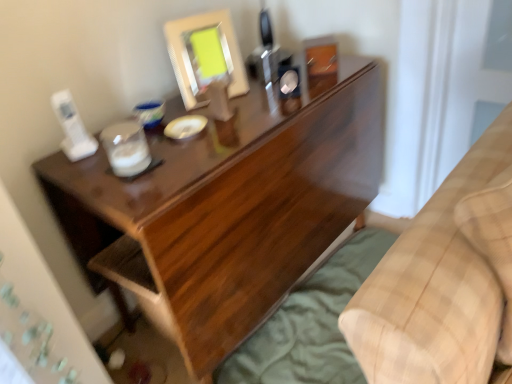
Question: Is dark wood desk at center looking in the opposite direction of beige plaid blanket at lower right?

Choices:
 (A) yes
 (B) no

Answer: (B)

Question: From a real-world perspective, is dark wood desk at center located beneath beige plaid blanket at lower right?

Choices:
 (A) yes
 (B) no

Answer: (A)

Question: Is dark wood desk at center located outside beige plaid blanket at lower right?

Choices:
 (A) no
 (B) yes

Answer: (B)

Question: From the image's perspective, is dark wood desk at center on beige plaid blanket at lower right?

Choices:
 (A) no
 (B) yes

Answer: (B)

Question: Is dark wood desk at center aimed at beige plaid blanket at lower right?

Choices:
 (A) yes
 (B) no

Answer: (A)

Question: Choose the correct answer: Is dark wood desk at center inside green fabric sheet at lower right or outside it?

Choices:
 (A) inside
 (B) outside

Answer: (B)

Question: In terms of size, does dark wood desk at center appear bigger or smaller than green fabric sheet at lower right?

Choices:
 (A) small
 (B) big

Answer: (B)

Question: From the image's perspective, is dark wood desk at center positioned above or below green fabric sheet at lower right?

Choices:
 (A) below
 (B) above

Answer: (B)

Question: Relative to green fabric sheet at lower right, is dark wood desk at center in front or behind?

Choices:
 (A) front
 (B) behind

Answer: (A)

Question: Is dark wood desk at center wider or thinner than beige plaid blanket at lower right?

Choices:
 (A) wide
 (B) thin

Answer: (A)

Question: In terms of size, does dark wood desk at center appear bigger or smaller than beige plaid blanket at lower right?

Choices:
 (A) small
 (B) big

Answer: (B)

Question: Considering their positions, is dark wood desk at center located in front of or behind beige plaid blanket at lower right?

Choices:
 (A) front
 (B) behind

Answer: (B)

Question: Is dark wood desk at center spatially inside beige plaid blanket at lower right, or outside of it?

Choices:
 (A) outside
 (B) inside

Answer: (A)

Question: From a real-world perspective, is beige plaid blanket at lower right above or below matte white frame at upper center?

Choices:
 (A) below
 (B) above

Answer: (A)

Question: Is beige plaid blanket at lower right inside or outside of matte white frame at upper center?

Choices:
 (A) outside
 (B) inside

Answer: (A)